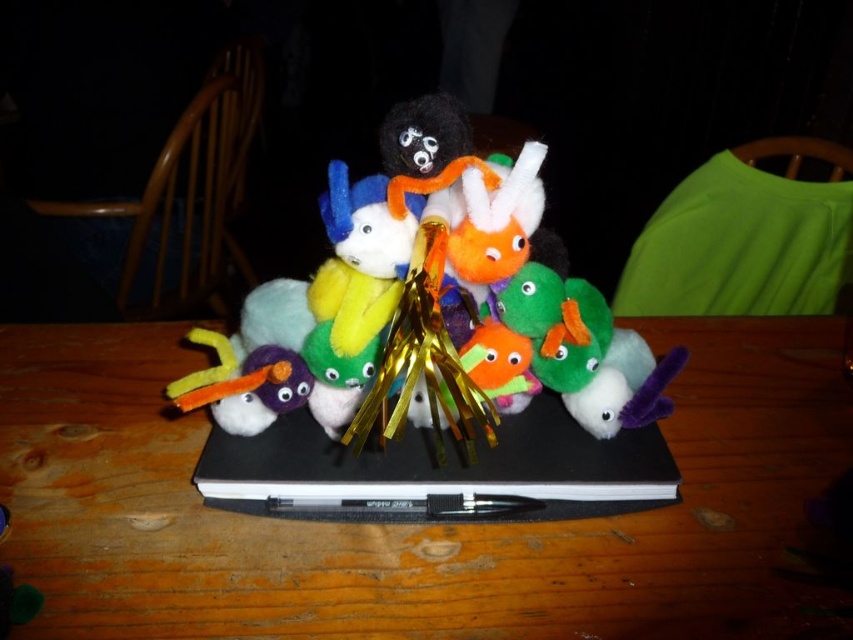
You are planning to place a rectangular box that is 1.2 meters wide on the wooden table at center. Considering the fuzzy multicolored stuffed animals at center are already on the table, can the box fit on the table without overlapping the stuffed animals?

The wooden table at center might be wider than fuzzy multicolored stuffed animals at center, so there is a possibility that the box could fit if the table has enough space. However, the exact dimensions of the table and the arrangement of the stuffed animals are not provided, so it is uncertain.

You are a photographer setting up a tripod to take a closeup of the wooden table at center and the fuzzy multicolored stuffed animals at center. Which object should you focus on first to ensure it appears sharp in the photo?

The wooden table at center is further to the viewer than the fuzzy multicolored stuffed animals at center, so you should focus on the wooden table at center first to ensure it appears sharp before adjusting for the other object.

You are organizing a small workshop and need to place a 12 inch wide project on the wooden table at center. Considering the black matte laptop at center is already placed there, will there be enough space?

The wooden table at center has a larger size compared to the black matte laptop at center, so there should be enough space to place the 12 inch wide project alongside the laptop.